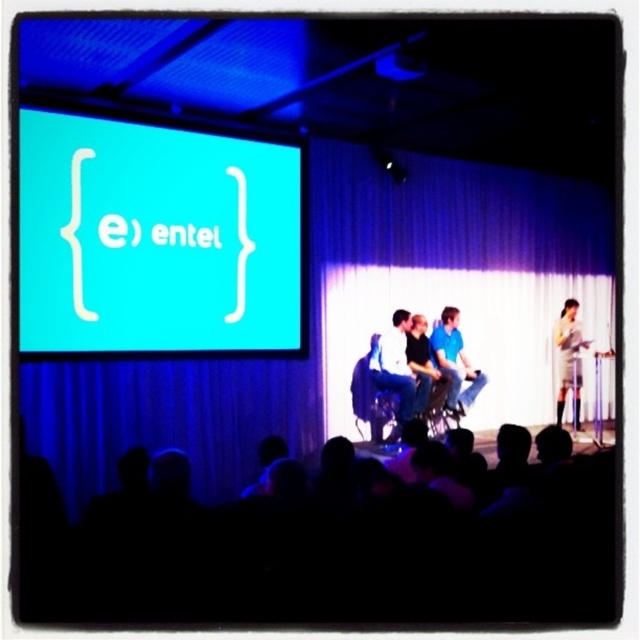
Question: Which object is closer to the camera taking this photo?

Choices:
 (A) teal matte projection screen at upper left
 (B) blue fabric curtain at upper center
 (C) blue fabric chair at center
 (D) matte white shirt at center

Answer: (A)

Question: Is teal matte projection screen at upper left wider than white dress at right?

Choices:
 (A) no
 (B) yes

Answer: (B)

Question: Which point is farther to the camera?

Choices:
 (A) (102, 330)
 (B) (444, 376)
 (C) (605, 237)

Answer: (C)

Question: Is teal matte projection screen at upper left smaller than matte white shirt at center?

Choices:
 (A) yes
 (B) no

Answer: (B)

Question: Which is nearer to the matte white shirt at center?

Choices:
 (A) blue fabric curtain at upper center
 (B) blue fabric chair at center
 (C) teal matte projection screen at upper left

Answer: (A)

Question: Observing the image, what is the correct spatial positioning of teal matte projection screen at upper left in reference to matte white shirt at center?

Choices:
 (A) right
 (B) left

Answer: (B)